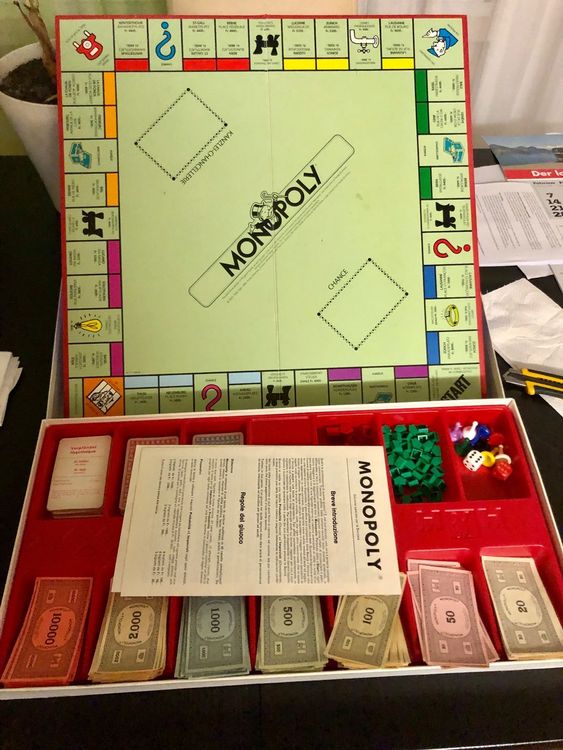
The height and width of the screenshot is (750, 563). I want to click on corner game spaces, so click(x=460, y=381), click(x=437, y=44), click(x=84, y=40), click(x=96, y=404).